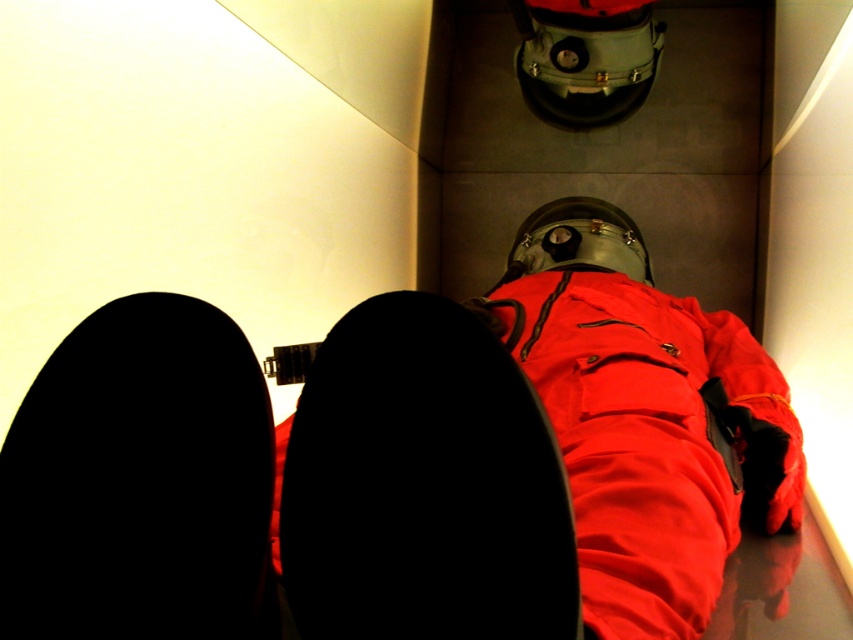
You are trying to reach the matte red jacket at center while standing in the confined space. Considering the position of the black matte boot at lower center, will you need to move it to access the jacket?

The black matte boot at lower center is located above the matte red jacket at center, so you would need to move the boot to access the jacket.

You are trying to reach the matte red jacket at center while standing near the black matte boot at lower center. Which object is closer to you?

The black matte boot at lower center is closer to you than the matte red jacket at center.

You are standing in a confined space and see the black matte shoe at lower left. If you want to reach it without moving your feet, can you touch it with your outstretched hand?

The black matte shoe at lower left is 19.19 inches away from the viewer. If you can reach 19.19 inches with your outstretched hand, then yes, you can touch it without moving your feet.